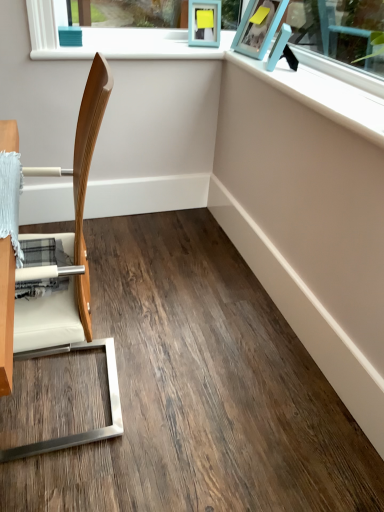
Question: Is wooden chair at left further to the viewer compared to teal matte picture frame at upper center, the first picture frame when ordered from left to right?

Choices:
 (A) no
 (B) yes

Answer: (A)

Question: From the image's perspective, would you say wooden chair at left is positioned over teal matte picture frame at upper center, the first picture frame when ordered from left to right?

Choices:
 (A) no
 (B) yes

Answer: (A)

Question: Considering the relative sizes of wooden chair at left and teal matte picture frame at upper center, the first picture frame when ordered from left to right, in the image provided, is wooden chair at left taller than teal matte picture frame at upper center, the first picture frame when ordered from left to right,?

Choices:
 (A) yes
 (B) no

Answer: (A)

Question: Does wooden chair at left appear on the left side of teal matte picture frame at upper center, which is the 3th picture frame in right-to-left order?

Choices:
 (A) yes
 (B) no

Answer: (A)

Question: From a real-world perspective, is wooden chair at left on top of teal matte picture frame at upper center, the first picture frame when ordered from left to right?

Choices:
 (A) no
 (B) yes

Answer: (A)

Question: Does wooden chair at left have a greater width compared to teal matte picture frame at upper center, which is the 3th picture frame in right-to-left order?

Choices:
 (A) yes
 (B) no

Answer: (A)

Question: From the image's perspective, is teal matte picture frame at upper center, which is the 3th picture frame in right-to-left order, on matte blue picture frame at upper right, marked as the third picture frame in a left-to-right arrangement?

Choices:
 (A) yes
 (B) no

Answer: (A)

Question: Does teal matte picture frame at upper center, which is the 3th picture frame in right-to-left order, have a larger size compared to matte blue picture frame at upper right, marked as the third picture frame in a left-to-right arrangement?

Choices:
 (A) yes
 (B) no

Answer: (A)

Question: Is teal matte picture frame at upper center, the first picture frame when ordered from left to right, positioned with its back to matte blue picture frame at upper right, marked as the first picture frame in a right-to-left arrangement?

Choices:
 (A) no
 (B) yes

Answer: (A)

Question: From a real-world perspective, is teal matte picture frame at upper center, the first picture frame when ordered from left to right, on matte blue picture frame at upper right, marked as the first picture frame in a right-to-left arrangement?

Choices:
 (A) no
 (B) yes

Answer: (B)

Question: Can you confirm if teal matte picture frame at upper center, which is the 3th picture frame in right-to-left order, is smaller than matte blue picture frame at upper right, marked as the first picture frame in a right-to-left arrangement?

Choices:
 (A) yes
 (B) no

Answer: (B)

Question: Can you confirm if teal matte picture frame at upper center, which is the 3th picture frame in right-to-left order, is shorter than matte blue picture frame at upper right, marked as the third picture frame in a left-to-right arrangement?

Choices:
 (A) no
 (B) yes

Answer: (A)

Question: Is blue plastic picture frame at upper right, the second picture frame in the left-to-right sequence, positioned in front of matte blue picture frame at upper right, marked as the third picture frame in a left-to-right arrangement?

Choices:
 (A) no
 (B) yes

Answer: (A)